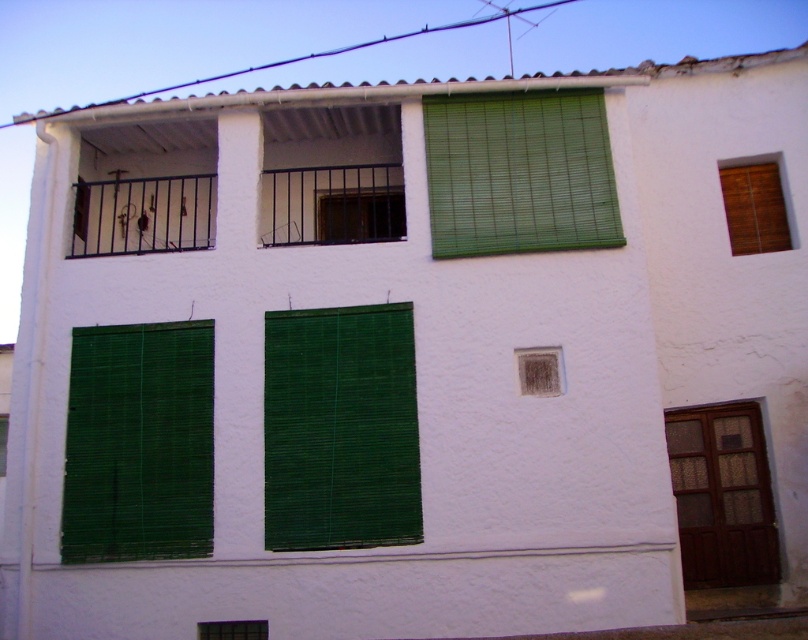
Can you confirm if wooden blinds at upper right is taller than green bamboo blinds at lower center?

Yes, wooden blinds at upper right is taller than green bamboo blinds at lower center.

Can you confirm if wooden blinds at upper right is shorter than green bamboo blinds at lower center?

No.

Where is `wooden blinds at upper right`? wooden blinds at upper right is located at coordinates (754, 208).

Can you confirm if black metal railing at upper center is shorter than black metal bars at upper center?

Incorrect, black metal railing at upper center's height does not fall short of black metal bars at upper center's.

Does black metal railing at upper center come in front of black metal bars at upper center?

That is True.

You are a GUI agent. You are given a task and a screenshot of the screen. Output one action in this format:
    pyautogui.click(x=<x>, y=<y>)
    Task: Click on the black metal railing at upper center
    
    Given the screenshot: What is the action you would take?
    pyautogui.click(x=331, y=204)

The image size is (808, 640). I want to click on black metal railing at upper center, so click(331, 204).

Does black metal railing at upper left have a greater width compared to green bamboo window at lower left?

Yes, black metal railing at upper left is wider than green bamboo window at lower left.

Which is in front, point (78, 189) or point (3, 417)?

Point (78, 189) is in front.

Locate an element on the screen. The width and height of the screenshot is (808, 640). black metal railing at upper left is located at coordinates (142, 214).